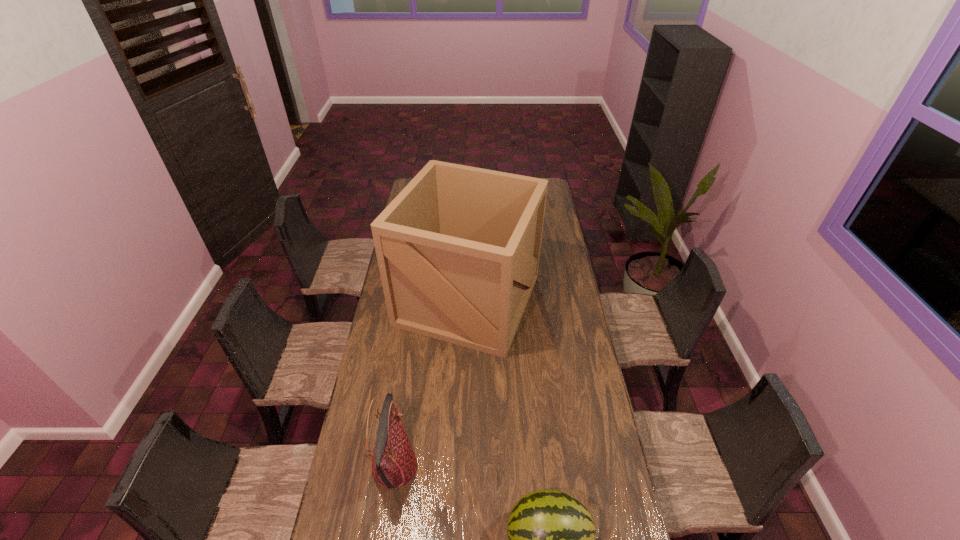
Identify the location of the tallest object. (458, 249).

Where is `the farthest object`? The image size is (960, 540). the farthest object is located at coordinates (458, 249).

Identify the location of the second tallest object. (394, 464).

Where is `handbag`? The width and height of the screenshot is (960, 540). handbag is located at coordinates (394, 464).

I want to click on vacant position located 0.220m on the front of the box, so click(465, 404).

The image size is (960, 540). In order to click on free space located 0.350m on the right of the second farthest object in this screenshot , I will do `click(520, 467)`.

Identify the location of box present at the left edge. The height and width of the screenshot is (540, 960). (458, 249).

What are the coordinates of `handbag positioned at the left edge` in the screenshot? It's located at (394, 464).

The image size is (960, 540). Identify the location of blank space at the left edge. (385, 309).

In the image, there is a desktop. Where is `vacant space at the right edge`? The width and height of the screenshot is (960, 540). vacant space at the right edge is located at coordinates (613, 505).